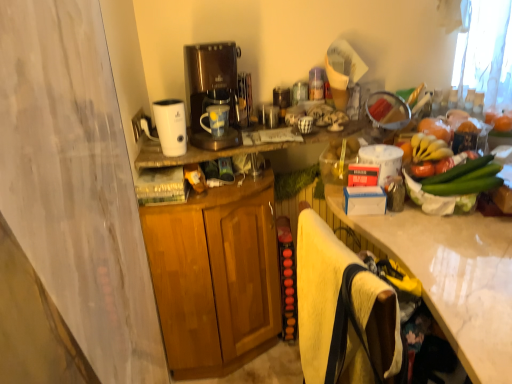
Where is `white marble countertop at right`? The width and height of the screenshot is (512, 384). white marble countertop at right is located at coordinates (453, 276).

Find the location of `white glossy humidifier at upper center`. white glossy humidifier at upper center is located at coordinates click(168, 126).

Identify the location of matte white mug at center. The height and width of the screenshot is (384, 512). (216, 120).

Locate an element on the screen. This screenshot has width=512, height=384. wooden cabinet at center is located at coordinates (215, 277).

Consider the image. Measure the distance between yellow fuzzy beach towel at lower right and camera.

yellow fuzzy beach towel at lower right is 31.92 inches from camera.

Locate an element on the screen. This screenshot has width=512, height=384. white marble countertop at right is located at coordinates (453, 276).

Does point (175, 148) appear closer or farther from the camera than point (444, 127)?

Clearly, point (175, 148) is more distant from the camera than point (444, 127).

From a real-world perspective, is white glossy humidifier at upper center physically above yellow matte bananas at upper right?

Yes, from a real-world perspective, white glossy humidifier at upper center is above yellow matte bananas at upper right.

Is white glossy humidifier at upper center positioned with its back to yellow matte bananas at upper right?

No.

Between white glossy humidifier at upper center and yellow matte bananas at upper right, which one has larger width?

Wider between the two is yellow matte bananas at upper right.

Considering the sizes of yellow fuzzy beach towel at lower right and matte white mug at center in the image, is yellow fuzzy beach towel at lower right wider or thinner than matte white mug at center?

yellow fuzzy beach towel at lower right is wider than matte white mug at center.

Is matte white mug at center completely or partially inside yellow fuzzy beach towel at lower right?

Definitely not — matte white mug at center is not inside yellow fuzzy beach towel at lower right.

Is the depth of yellow fuzzy beach towel at lower right less than that of matte white mug at center?

Yes, the depth of yellow fuzzy beach towel at lower right is less than that of matte white mug at center.

Where is `beach towel on the right of matte white mug at center`? beach towel on the right of matte white mug at center is located at coordinates (342, 311).

Is white marble countertop at right looking in the opposite direction of white glossy humidifier at upper center?

white marble countertop at right is not turned away from white glossy humidifier at upper center.

How different are the orientations of white marble countertop at right and white glossy humidifier at upper center in degrees?

The angle between the facing direction of white marble countertop at right and the facing direction of white glossy humidifier at upper center is 84.5 degrees.

Is point (381, 218) closer to camera compared to point (174, 120)?

Yes, it is in front of point (174, 120).

From the image's perspective, is white marble countertop at right positioned above or below white glossy humidifier at upper center?

white marble countertop at right is below white glossy humidifier at upper center.

Between white glossy humidifier at upper center and white marble countertop at right, which one is positioned behind?

white glossy humidifier at upper center is further from the camera.

Which point is more distant from viewer, (153, 136) or (486, 279)?

The point (153, 136) is behind.

Can you confirm if white glossy humidifier at upper center is positioned to the left of white marble countertop at right?

Yes.

Looking at this image, is white glossy humidifier at upper center not inside white marble countertop at right?

Yes.

I want to click on cabinetry below the white glossy humidifier at upper center (from the image's perspective), so click(215, 277).

Could you tell me if white glossy humidifier at upper center is facing wooden cabinet at center?

No, white glossy humidifier at upper center is not facing towards wooden cabinet at center.

Is white glossy humidifier at upper center wider or thinner than wooden cabinet at center?

white glossy humidifier at upper center is thinner than wooden cabinet at center.

Which is more distant, (420, 123) or (195, 359)?

The point (195, 359) is more distant.

Looking at the image, does yellow matte bananas at upper right seem bigger or smaller compared to wooden cabinet at center?

In the image, yellow matte bananas at upper right appears to be smaller than wooden cabinet at center.

Are yellow matte bananas at upper right and wooden cabinet at center located far from each other?

yellow matte bananas at upper right is actually quite close to wooden cabinet at center.

Where is `beach towel that appears below the white glossy humidifier at upper center (from the image's perspective)`? The image size is (512, 384). beach towel that appears below the white glossy humidifier at upper center (from the image's perspective) is located at coordinates (342, 311).

Is white glossy humidifier at upper center turned away from yellow fuzzy beach towel at lower right?

No, yellow fuzzy beach towel at lower right is not at the back of white glossy humidifier at upper center.

Is point (161, 146) closer or farther from the camera than point (367, 346)?

Point (161, 146) appears to be farther away from the viewer than point (367, 346).

Considering their positions, is white glossy humidifier at upper center located in front of or behind yellow fuzzy beach towel at lower right?

white glossy humidifier at upper center is positioned farther from the viewer than yellow fuzzy beach towel at lower right.

Identify the location of appliance above the yellow matte bananas at upper right (from the image's perspective). (168, 126).

Identify the location of beach towel lying below the matte white mug at center (from the image's perspective). (342, 311).

Looking at the image, which one is located further to wooden cabinet at center, yellow fuzzy beach towel at lower right or yellow matte bananas at upper right?

yellow matte bananas at upper right lies further to wooden cabinet at center than the other object.

Estimate the real-world distances between objects in this image. Which object is further from wooden cabinet at center, white marble countertop at right or yellow matte bananas at upper right?

yellow matte bananas at upper right is further to wooden cabinet at center.

When comparing their distances from yellow matte bananas at upper right, does white marble countertop at right or white glossy humidifier at upper center seem further?

white glossy humidifier at upper center is positioned further to the anchor yellow matte bananas at upper right.

From the image, which object appears to be nearer to white glossy humidifier at upper center, yellow matte bananas at upper right or matte white mug at center?

matte white mug at center.

Considering their positions, is white glossy humidifier at upper center positioned closer to matte white mug at center than yellow fuzzy beach towel at lower right?

Among the two, white glossy humidifier at upper center is located nearer to matte white mug at center.

From the image, which object appears to be farther from yellow fuzzy beach towel at lower right, matte white mug at center or white marble countertop at right?

matte white mug at center lies further to yellow fuzzy beach towel at lower right than the other object.

Based on their spatial positions, is white marble countertop at right or white glossy humidifier at upper center further from matte white mug at center?

white marble countertop at right.

Estimate the real-world distances between objects in this image. Which object is closer to wooden cabinet at center, yellow fuzzy beach towel at lower right or white glossy humidifier at upper center?

white glossy humidifier at upper center.

Image resolution: width=512 pixels, height=384 pixels. In order to click on beach towel between white marble countertop at right and matte white mug at center along the z-axis in this screenshot , I will do `click(342, 311)`.

Identify the location of cabinetry between white marble countertop at right and yellow matte bananas at upper right in the front-back direction. The width and height of the screenshot is (512, 384). tap(215, 277).

In order to click on mug between white marble countertop at right and yellow matte bananas at upper right along the z-axis in this screenshot , I will do `click(216, 120)`.

You are a GUI agent. You are given a task and a screenshot of the screen. Output one action in this format:
    pyautogui.click(x=<x>, y=<y>)
    Task: Click on the cabinetry located between yellow fuzzy beach towel at lower right and matte white mug at center in the depth direction
    
    Given the screenshot: What is the action you would take?
    pyautogui.click(x=215, y=277)